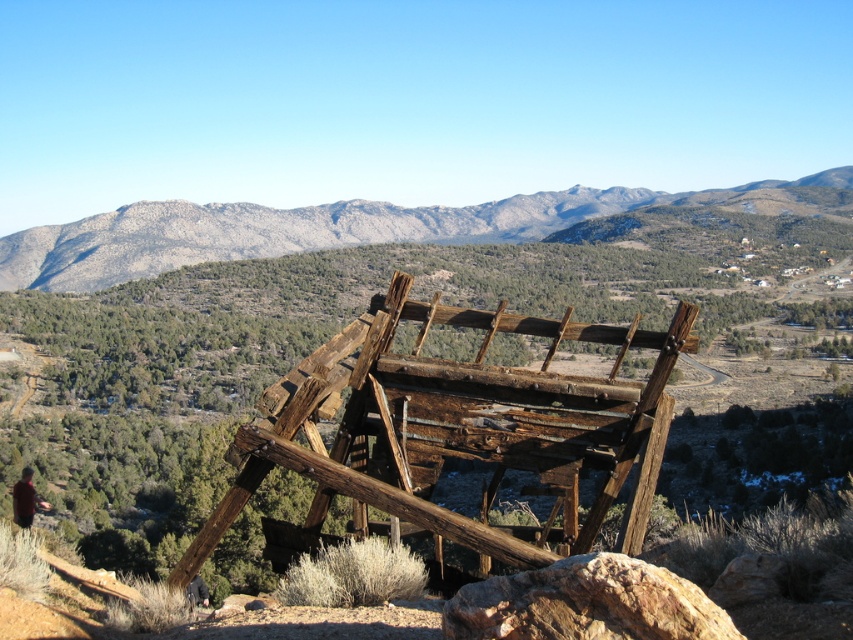
You are a hiker who has stumbled upon this mountainous area. You need to cross from the weathered wood structure at center to the rusty metal rock at lower right. Which direction should you move relative to the structure to reach the rock?

You should move to the right relative to the weathered wood structure at center to reach the rusty metal rock at lower right since the structure is to the left of the rock.

You are standing at the point marked as point (463, 429) in the rugged mountain landscape. What is the surface you are currently standing on?

The point (463, 429) is on the weathered wood structure at center, so you are standing on the weathered wood structure at center.

You are a hiker trying to reach the summit of the gray rocky mountain at center. Based on the coordinates provided in the scene description, can you determine if the mountain is positioned centrally in the image?

The gray rocky mountain at center is located at point coordinates (351,227), which indicates it is positioned centrally within the image frame.